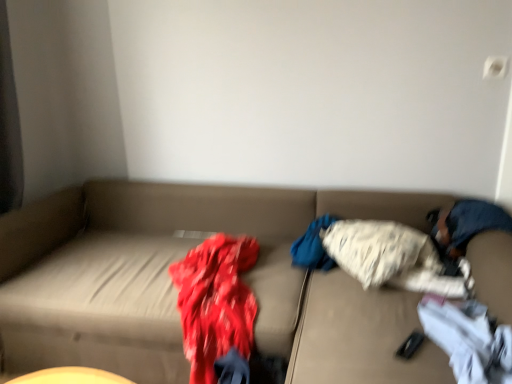
Question: From a real-world perspective, is fluffy white blanket at center, the second clothing from the front, over white cotton socks at lower right, the first clothing from the front?

Choices:
 (A) no
 (B) yes

Answer: (B)

Question: Does fluffy white blanket at center, which is counted as the 1th clothing, starting from the back, have a larger size compared to white cotton socks at lower right, which is the 2th clothing in back-to-front order?

Choices:
 (A) no
 (B) yes

Answer: (B)

Question: Is fluffy white blanket at center, the second clothing from the front, not near white cotton socks at lower right, the first clothing from the front?

Choices:
 (A) yes
 (B) no

Answer: (B)

Question: Can you confirm if fluffy white blanket at center, which is counted as the 1th clothing, starting from the back, is smaller than white cotton socks at lower right, the first clothing from the front?

Choices:
 (A) yes
 (B) no

Answer: (B)

Question: Can you confirm if fluffy white blanket at center, the second clothing from the front, is shorter than white cotton socks at lower right, the first clothing from the front?

Choices:
 (A) no
 (B) yes

Answer: (A)

Question: Is blue denim jeans at right bigger or smaller than beige fabric couch at center?

Choices:
 (A) small
 (B) big

Answer: (A)

Question: Is blue denim jeans at right wider or thinner than beige fabric couch at center?

Choices:
 (A) thin
 (B) wide

Answer: (A)

Question: In the image, is blue denim jeans at right positioned in front of or behind beige fabric couch at center?

Choices:
 (A) behind
 (B) front

Answer: (A)

Question: From their relative heights in the image, would you say blue denim jeans at right is taller or shorter than beige fabric couch at center?

Choices:
 (A) tall
 (B) short

Answer: (B)

Question: Is point (497, 359) positioned closer to the camera than point (337, 238)?

Choices:
 (A) farther
 (B) closer

Answer: (B)

Question: In terms of height, does white cotton socks at lower right, the first clothing from the front, look taller or shorter compared to fluffy white blanket at center, the second clothing from the front?

Choices:
 (A) tall
 (B) short

Answer: (B)

Question: In the image, is white cotton socks at lower right, the first clothing from the front, positioned in front of or behind fluffy white blanket at center, which is counted as the 1th clothing, starting from the back?

Choices:
 (A) front
 (B) behind

Answer: (A)

Question: Visually, is white cotton socks at lower right, the first clothing from the front, positioned to the left or to the right of fluffy white blanket at center, the second clothing from the front?

Choices:
 (A) left
 (B) right

Answer: (B)

Question: In the image, is white cotton socks at lower right, which is the 2th clothing in back-to-front order, positioned in front of or behind blue denim jeans at right?

Choices:
 (A) behind
 (B) front

Answer: (B)

Question: Would you say white cotton socks at lower right, the first clothing from the front, is inside or outside blue denim jeans at right?

Choices:
 (A) inside
 (B) outside

Answer: (B)